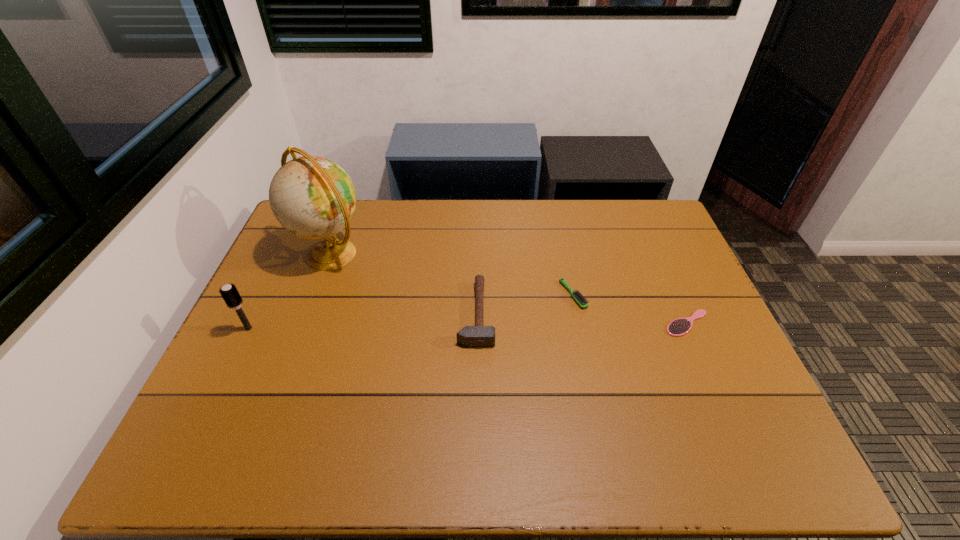
Locate an element on the screen. This screenshot has height=540, width=960. vacant space at the far edge of the desktop is located at coordinates (394, 231).

The width and height of the screenshot is (960, 540). In the image, there is a desktop. What are the coordinates of `vacant space at the near edge` in the screenshot? It's located at (482, 462).

The image size is (960, 540). Find the location of `vacant space at the left edge of the desktop`. vacant space at the left edge of the desktop is located at coordinates (280, 255).

Image resolution: width=960 pixels, height=540 pixels. I want to click on vacant space at the right edge, so click(x=635, y=245).

This screenshot has height=540, width=960. Find the location of `free space at the far left corner of the desktop`. free space at the far left corner of the desktop is located at coordinates (296, 236).

The height and width of the screenshot is (540, 960). Find the location of `free space at the near right corner of the desktop`. free space at the near right corner of the desktop is located at coordinates (774, 446).

Locate an element on the screen. Image resolution: width=960 pixels, height=540 pixels. vacant region between the third object from right to left and the farthest object is located at coordinates (403, 284).

This screenshot has height=540, width=960. Find the location of `vacant space that is in between the rightmost object and the second object from right to left`. vacant space that is in between the rightmost object and the second object from right to left is located at coordinates (630, 309).

Find the location of a particular element. The height and width of the screenshot is (540, 960). blank region between the tallest object and the leftmost object is located at coordinates (290, 291).

Where is `vacant space in between the second shortest object and the farthest object`? Image resolution: width=960 pixels, height=540 pixels. vacant space in between the second shortest object and the farthest object is located at coordinates (452, 274).